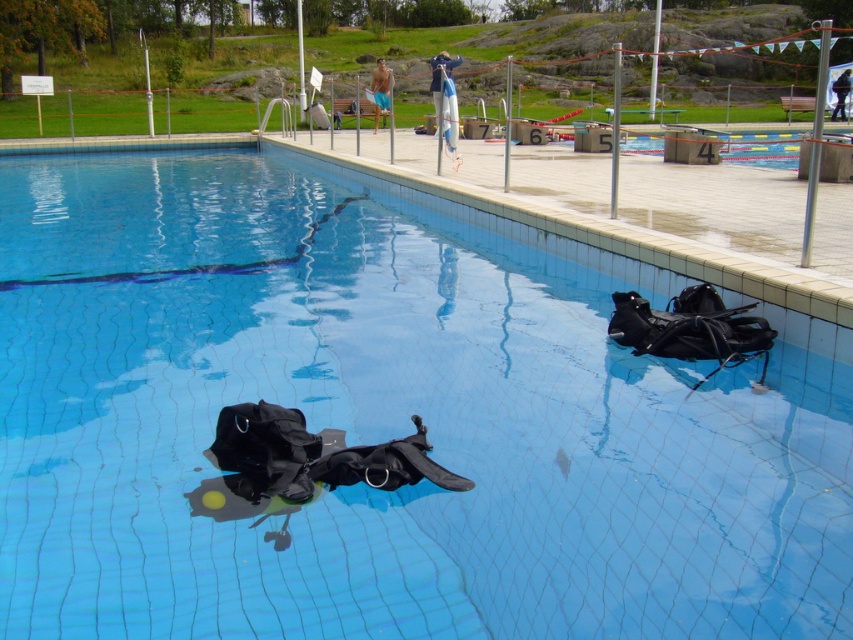
You are standing at the edge of the pool and want to reach the blue fabric shorts at upper center. If your maximum reaching distance is 50 feet, can you grab them without moving closer?

The blue fabric shorts at upper center are 51.38 feet away from you, which is beyond your maximum reaching distance of 50 feet. You need to move closer to grab them.

Based on the photo, you are a lifeguard standing on the pool deck and see a swimmer wearing blue fabric shorts at upper center and a person carrying a black fabric backpack at lower center. Which object is taller?

The blue fabric shorts at upper center is much taller than the black fabric backpack at lower center.

You are standing on the pool deck and see the blue fabric shorts at upper center and the black fabric backpack at lower center. Which object is positioned to the left of the other?

The blue fabric shorts at upper center is to the left of the black fabric backpack at lower center.